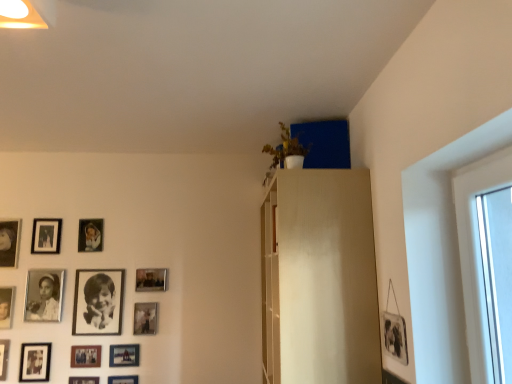
Question: Does point (82, 357) appear closer or farther from the camera than point (7, 317)?

Choices:
 (A) closer
 (B) farther

Answer: (A)

Question: Considering the relative positions of matte black picture frame at lower left, the 6th picture frame in the right-to-left sequence, and matte black photo frame at lower left, marked as the 2th picture frame in a left-to-right arrangement, in the image provided, is matte black picture frame at lower left, the 6th picture frame in the right-to-left sequence, to the left or to the right of matte black photo frame at lower left, marked as the 2th picture frame in a left-to-right arrangement,?

Choices:
 (A) right
 (B) left

Answer: (A)

Question: Estimate the real-world distances between objects in this image. Which object is closer to the matte black picture frame at lower center, the third picture frame viewed from the right?

Choices:
 (A) matte black picture frame at lower left, which is counted as the 12th picture frame, starting from the right
 (B) matte black picture frame at lower left, the 6th picture frame in the right-to-left sequence
 (C) matte black photo frame at lower left, the thirteenth picture frame from the right
 (D) metallic silver picture frame at lower center, the 14th picture frame in the left-to-right sequence
 (E) black matte photo frame at lower left, the 9th picture frame positioned from the right

Answer: (B)

Question: Which object is positioned farthest from the matte black picture frame at lower left, which is the third picture frame from left to right?

Choices:
 (A) matte black picture frame at upper left, arranged as the 10th picture frame when viewed from the right
 (B) matte black picture frame at lower center, the third picture frame viewed from the right
 (C) matte black photo frame at lower left, marked as the 2th picture frame in a left-to-right arrangement
 (D) matte black picture frame at upper left, placed as the 8th picture frame when sorted from right to left
 (E) matte black picture frame at lower left, arranged as the 9th picture frame when viewed from the left

Answer: (D)